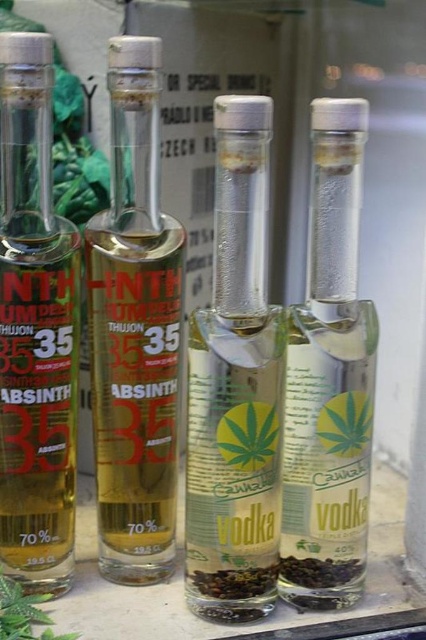
You are a bartender preparing a drink and need to know which ingredient is taller. You have a transparent glass vodka at right and a green leafy parsley at lower left. Which one is taller?

The transparent glass vodka at right is taller than the green leafy parsley at lower left according to the description.

Looking at this image, you are a bartender preparing a drink and need to reach for the transparent glass vodka at center and the green leafy parsley at lower left. Which object is closer to you?

The transparent glass vodka at center is closer to you because it is in front of the green leafy parsley at lower left.